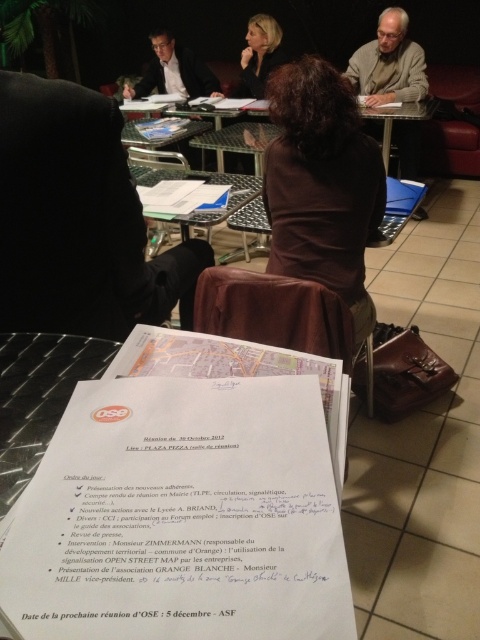
Who is positioned more to the right, light beige sweater at upper right or blonde hair at center?

From the viewer's perspective, light beige sweater at upper right appears more on the right side.

Does light beige sweater at upper right have a lesser height compared to blonde hair at center?

No.

Between point (420, 56) and point (253, 60), which one is positioned behind?

Positioned behind is point (253, 60).

I want to click on light beige sweater at upper right, so click(x=388, y=64).

Can you confirm if white paper at center is thinner than metallic silver table at center?

Yes.

Is point (264, 438) positioned behind point (261, 189)?

No, it is in front of (261, 189).

The image size is (480, 640). Describe the element at coordinates (181, 516) in the screenshot. I see `white paper at center` at that location.

Find the location of a particular element. The height and width of the screenshot is (640, 480). white paper at center is located at coordinates (181, 516).

Is black fabric jacket at left smaller than light beige sweater at upper right?

Correct, black fabric jacket at left occupies less space than light beige sweater at upper right.

Who is lower down, black fabric jacket at left or light beige sweater at upper right?

Positioned lower is black fabric jacket at left.

Who is more distant from viewer, (x=12, y=193) or (x=386, y=10)?

Positioned behind is point (x=386, y=10).

In order to click on black fabric jacket at left in this screenshot , I will do `click(78, 220)`.